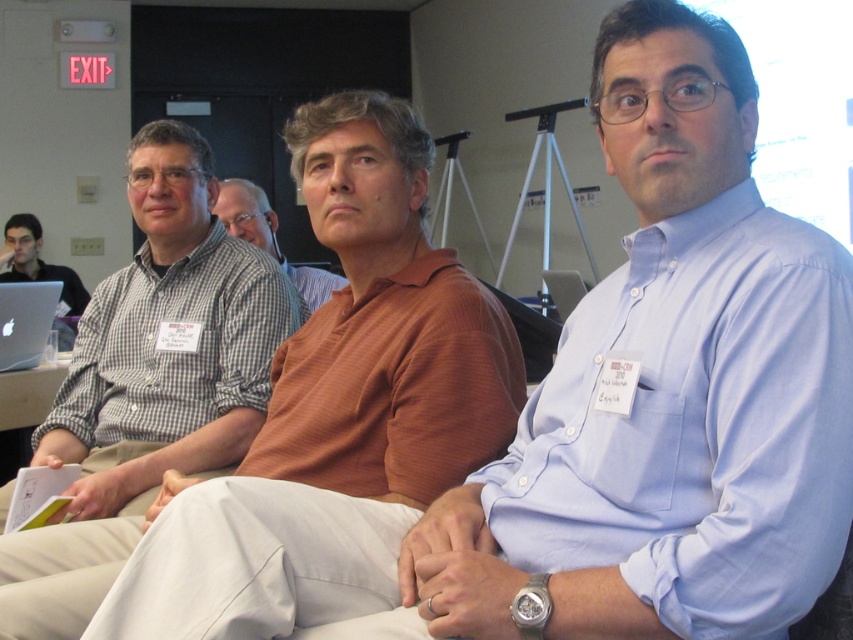
Locate an element on the screen. The width and height of the screenshot is (853, 640). silver metallic laptop at left is located at coordinates (25, 321).

Does orange striped shirt at center have a lesser width compared to silver metallic laptop at left?

Incorrect, orange striped shirt at center's width is not less than silver metallic laptop at left's.

Does orange striped shirt at center come behind silver metallic laptop at left?

No.

Does point (146, 596) come farther from viewer compared to point (49, 298)?

No, it is not.

Locate an element on the screen. The height and width of the screenshot is (640, 853). orange striped shirt at center is located at coordinates (338, 410).

Can you confirm if checkered shirt at left is positioned below silver metallic laptop at center?

Yes, checkered shirt at left is below silver metallic laptop at center.

Measure the distance from checkered shirt at left to silver metallic laptop at center.

A distance of 1.99 meters exists between checkered shirt at left and silver metallic laptop at center.

In order to click on checkered shirt at left in this screenshot , I will do `click(149, 381)`.